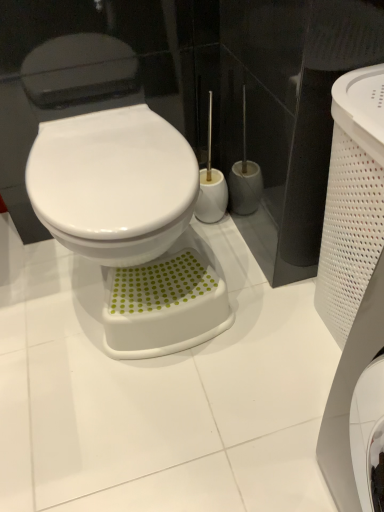
This screenshot has width=384, height=512. I want to click on vacant space situated above green dotted plastic step stool at lower center (from a real-world perspective), so click(x=155, y=287).